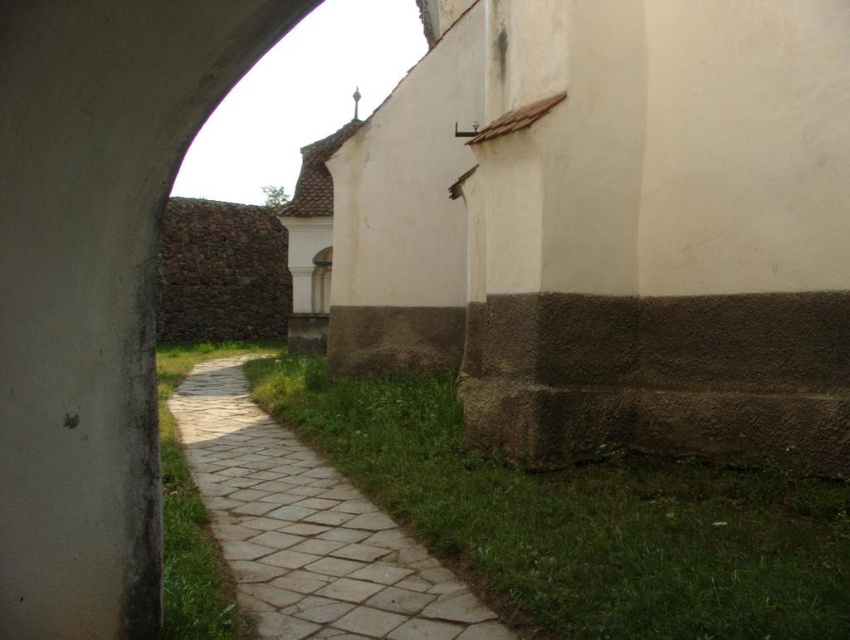
You are a maintenance worker needing to reach the natural stone path at center from the green grass at lower right. Given that your equipment can only move across a gap of up to 36 inches, will you be able to traverse the gap between them?

The distance between the green grass at lower right and natural stone path at center is 39.12 inches, which exceeds the equipment maximum gap of 36 inches. Therefore, you cannot traverse the gap between them.

You are standing at the curved archway in the historic structure. There is a point marked at coordinates [581,518] in the image. Based on the scene description, what is located at that point?

The point at coordinates [581,518] indicates green grass at lower right.